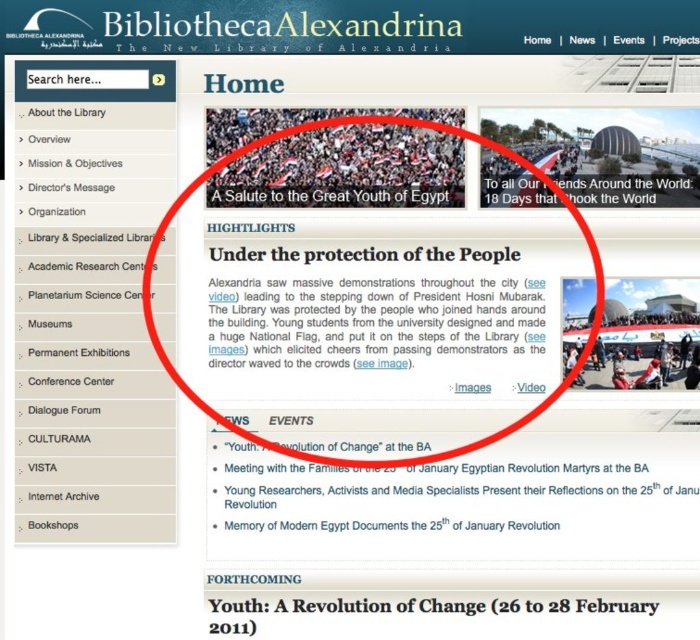
Is blue fabric banner at upper right smaller than matte black flag at center?

No.

Find the location of a particular element. blue fabric banner at upper right is located at coordinates (608, 152).